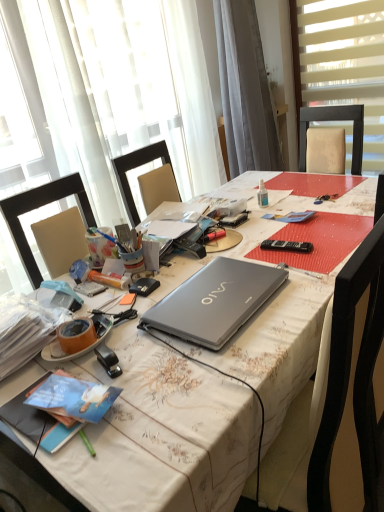
Image resolution: width=384 pixels, height=512 pixels. What are the coordinates of `unoccupied region to the right of black plastic remote control at center` in the screenshot? It's located at (329, 237).